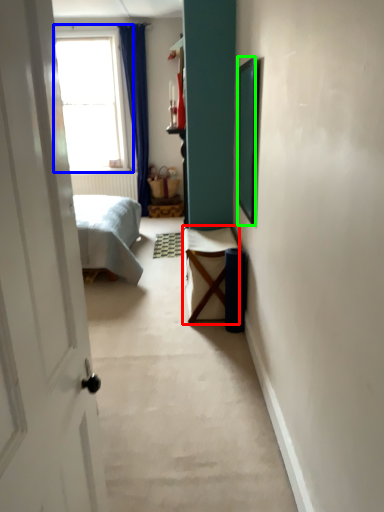
Question: Estimate the real-world distances between objects in this image. Which object is farther from furniture (highlighted by a red box), window (highlighted by a blue box) or picture frame (highlighted by a green box)?

Choices:
 (A) window
 (B) picture frame

Answer: (A)